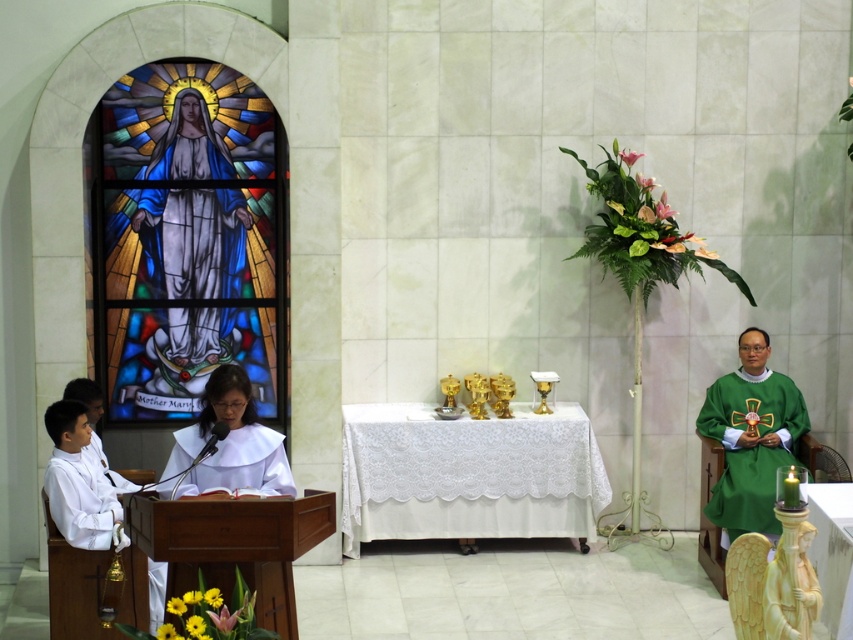
Locate an element on the screen. The image size is (853, 640). stained glass at left is located at coordinates (187, 241).

Who is lower down, stained glass at left or white matte robe at left?

white matte robe at left is below.

Is point (181, 88) in front of point (138, 563)?

That is False.

This screenshot has width=853, height=640. Find the location of `stained glass at left`. stained glass at left is located at coordinates tap(187, 241).

The height and width of the screenshot is (640, 853). What do you see at coordinates (187, 241) in the screenshot? I see `stained glass at left` at bounding box center [187, 241].

Based on the photo, between stained glass at left and white clothed figure at center, which one is positioned lower?

white clothed figure at center is below.

Is point (218, 269) behind point (167, 490)?

Yes, it is behind point (167, 490).

Find the location of a particular element. stained glass at left is located at coordinates (187, 241).

Which is behind, point (181, 368) or point (759, 420)?

The point (181, 368) is more distant.

Can you confirm if stained glass at left is taller than green satin robe at right?

Yes, stained glass at left is taller than green satin robe at right.

In order to click on stained glass at left in this screenshot , I will do `click(187, 241)`.